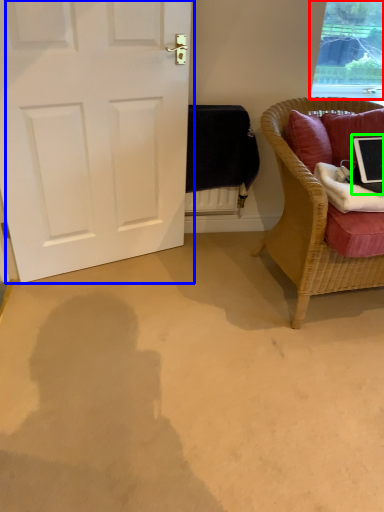
Question: Which object is the farthest from window (highlighted by a red box)? Choose among these: door (highlighted by a blue box) or laptop (highlighted by a green box).

Choices:
 (A) door
 (B) laptop

Answer: (A)